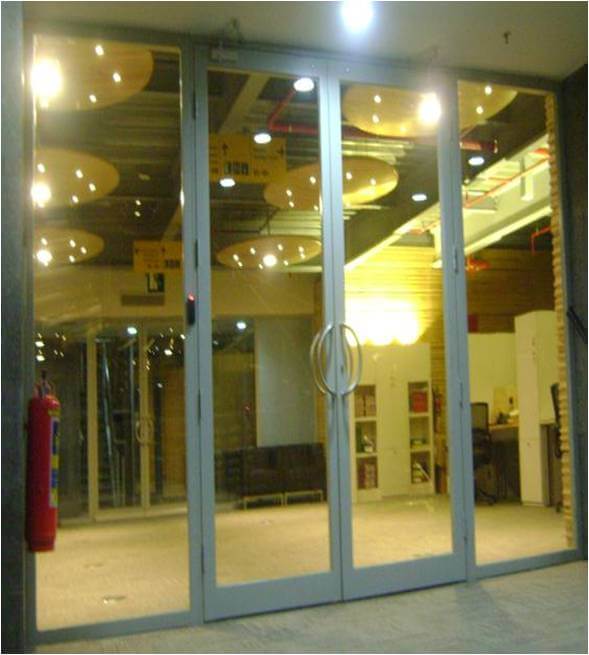
Image resolution: width=589 pixels, height=655 pixels. What are the coordinates of `wall` in the screenshot? It's located at (486, 305), (95, 303).